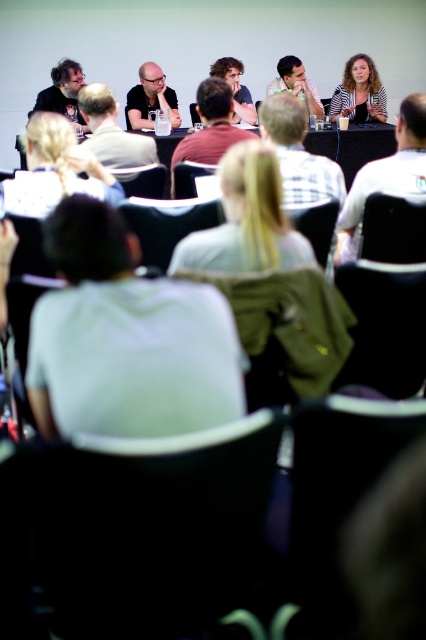
You are an event organizer who needs to arrange name tags for two panelists wearing white cotton shirt at center and white checkered shirt at center. Since both shirts are white, you want to ensure the name tags are placed in a way that they are easily visible. Considering their shirt sizes, which panelist might need a larger name tag to ensure visibility?

The white checkered shirt at center occupies more space than the white cotton shirt at center, so placing a larger name tag on the white checkered shirt at center would ensure better visibility.